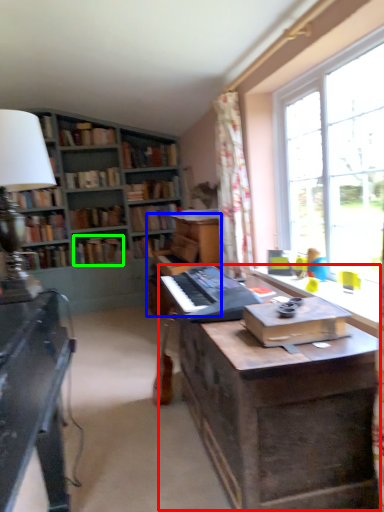
Question: Based on their relative distances, which object is nearer to table (highlighted by a red box)? Choose from piano (highlighted by a blue box) and book (highlighted by a green box).

Choices:
 (A) piano
 (B) book

Answer: (A)